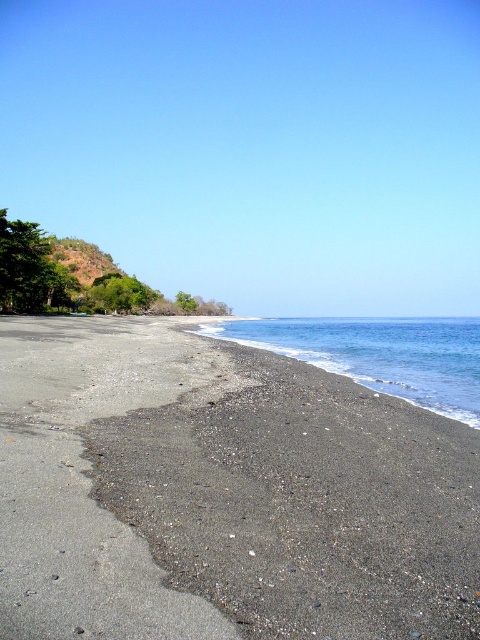
Question: Does dark gray sand at lower left have a greater width compared to blue smooth water at center?

Choices:
 (A) yes
 (B) no

Answer: (B)

Question: In this image, where is dark gray sand at lower left located relative to blue smooth water at center?

Choices:
 (A) below
 (B) above

Answer: (A)

Question: Is dark gray sand at lower left closer to the viewer compared to blue smooth water at center?

Choices:
 (A) yes
 (B) no

Answer: (A)

Question: Among these objects, which one is nearest to the camera?

Choices:
 (A) dark gray sand at lower left
 (B) blue smooth water at center

Answer: (A)